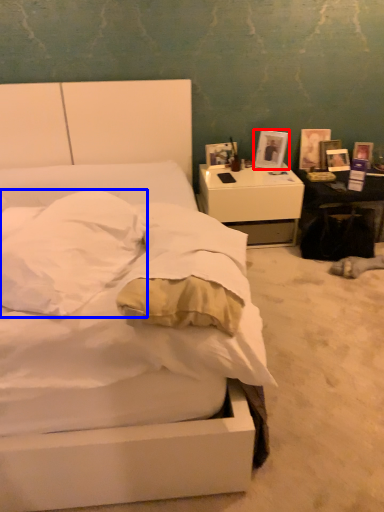
Question: Which of the following is the closest to the observer, picture frame (highlighted by a red box) or pillow (highlighted by a blue box)?

Choices:
 (A) picture frame
 (B) pillow

Answer: (B)